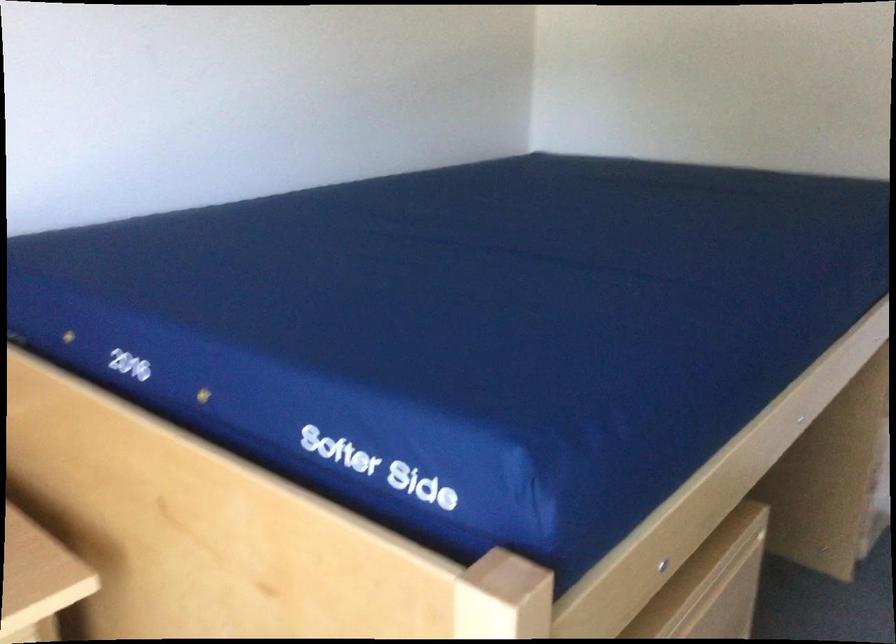
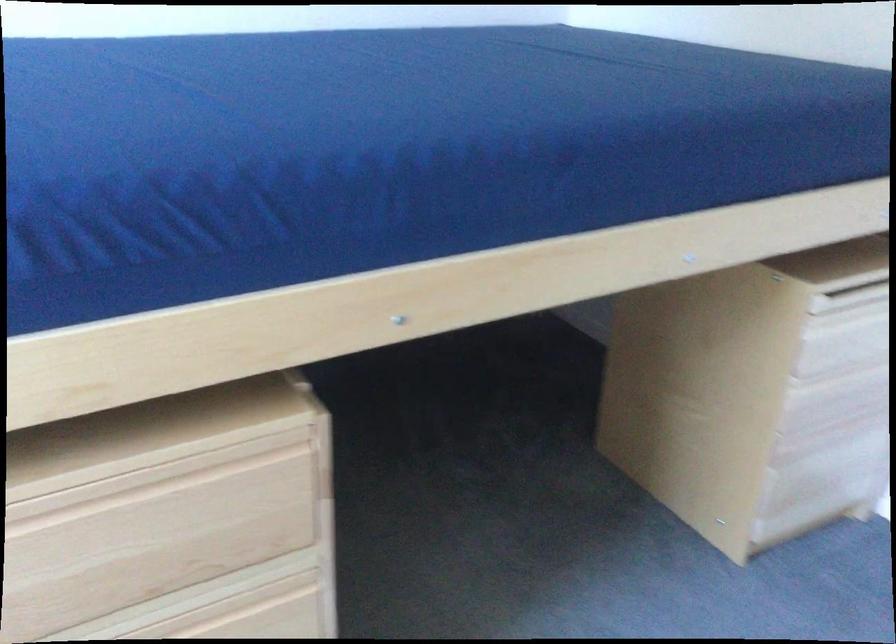
Question: How did the camera likely rotate?

Choices:
 (A) Left
 (B) Right
 (C) Up
 (D) Down

Answer: (A)